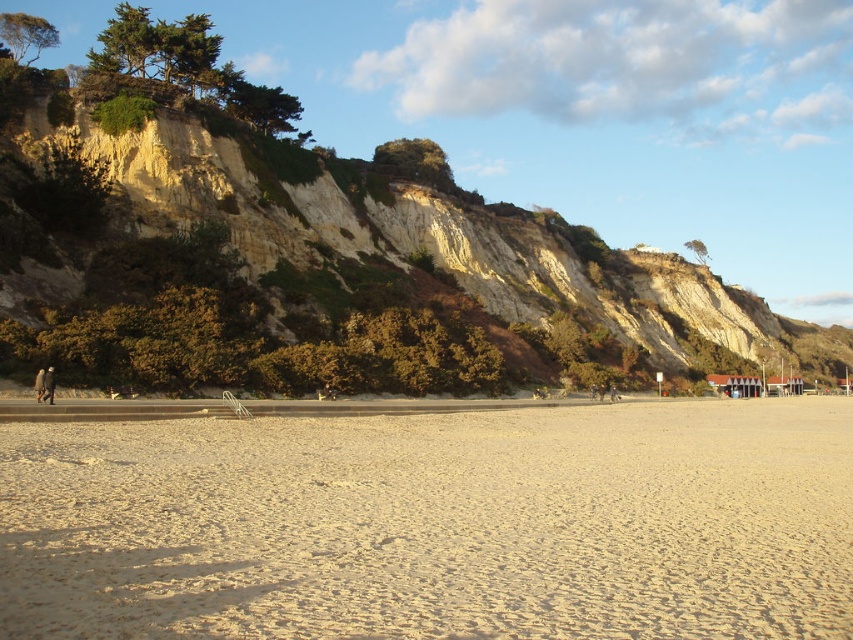
Question: Does beige sandy beach at lower center have a larger size compared to light brown leather jacket at lower left?

Choices:
 (A) no
 (B) yes

Answer: (B)

Question: Which of these objects is positioned closest to the brown rocky cliff at upper left?

Choices:
 (A) brown wool coat at left
 (B) light brown leather jacket at lower left
 (C) beige sandy beach at lower center

Answer: (C)

Question: Considering the relative positions of light brown leather jacket at lower left and brown wool coat at left in the image provided, where is light brown leather jacket at lower left located with respect to brown wool coat at left?

Choices:
 (A) right
 (B) left

Answer: (A)

Question: Estimate the real-world distances between objects in this image. Which object is farther from the brown rocky cliff at upper left?

Choices:
 (A) light brown leather jacket at lower left
 (B) brown wool coat at left

Answer: (B)

Question: Which of the following is the closest to the observer?

Choices:
 (A) brown rocky cliff at upper left
 (B) brown wool coat at left
 (C) light brown leather jacket at lower left
 (D) beige sandy beach at lower center

Answer: (D)

Question: Is beige sandy beach at lower center above light brown leather jacket at lower left?

Choices:
 (A) no
 (B) yes

Answer: (A)